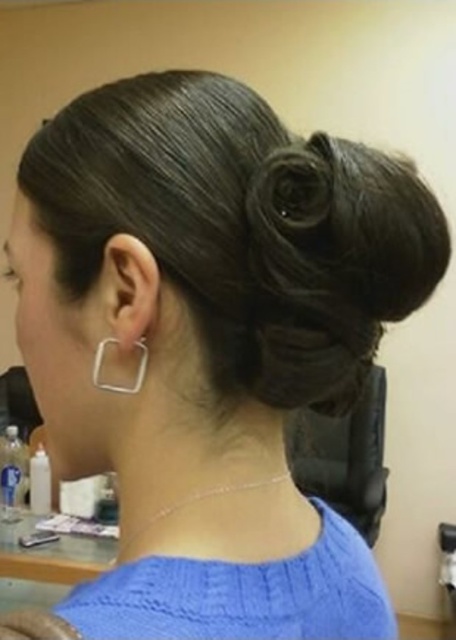
Question: Does dark brown hair at upper center come behind silver metallic square at lower left?

Choices:
 (A) no
 (B) yes

Answer: (A)

Question: Which point is closer to the camera?

Choices:
 (A) dark brown hair at upper center
 (B) silver metallic square at lower left

Answer: (A)

Question: Where is dark brown hair at upper center located in relation to silver metallic square at lower left in the image?

Choices:
 (A) below
 (B) above

Answer: (A)

Question: Does dark brown hair at upper center appear on the left side of silver metallic square at lower left?

Choices:
 (A) yes
 (B) no

Answer: (A)

Question: Among these points, which one is nearest to the camera?

Choices:
 (A) (27, 636)
 (B) (107, 342)

Answer: (A)